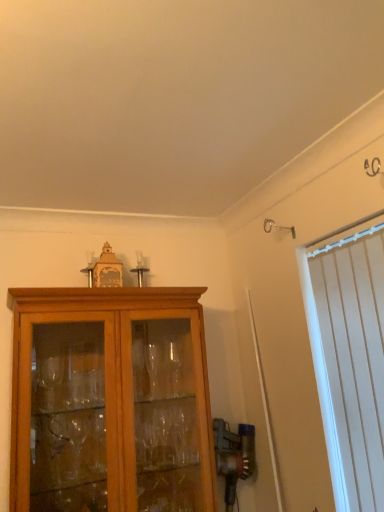
Question: Is matte wood cabinet at center bigger or smaller than white vertical blinds at right?

Choices:
 (A) big
 (B) small

Answer: (A)

Question: Is matte wood cabinet at center in front of or behind white vertical blinds at right in the image?

Choices:
 (A) behind
 (B) front

Answer: (A)

Question: In the image, is matte wood cabinet at center on the left side or the right side of white vertical blinds at right?

Choices:
 (A) right
 (B) left

Answer: (B)

Question: Considering their positions, is white vertical blinds at right located in front of or behind matte wood cabinet at center?

Choices:
 (A) front
 (B) behind

Answer: (A)

Question: From a real-world perspective, is white vertical blinds at right above or below matte wood cabinet at center?

Choices:
 (A) below
 (B) above

Answer: (B)

Question: Considering the positions of white vertical blinds at right and matte wood cabinet at center in the image, is white vertical blinds at right wider or thinner than matte wood cabinet at center?

Choices:
 (A) thin
 (B) wide

Answer: (A)

Question: Is white vertical blinds at right taller or shorter than matte wood cabinet at center?

Choices:
 (A) tall
 (B) short

Answer: (A)